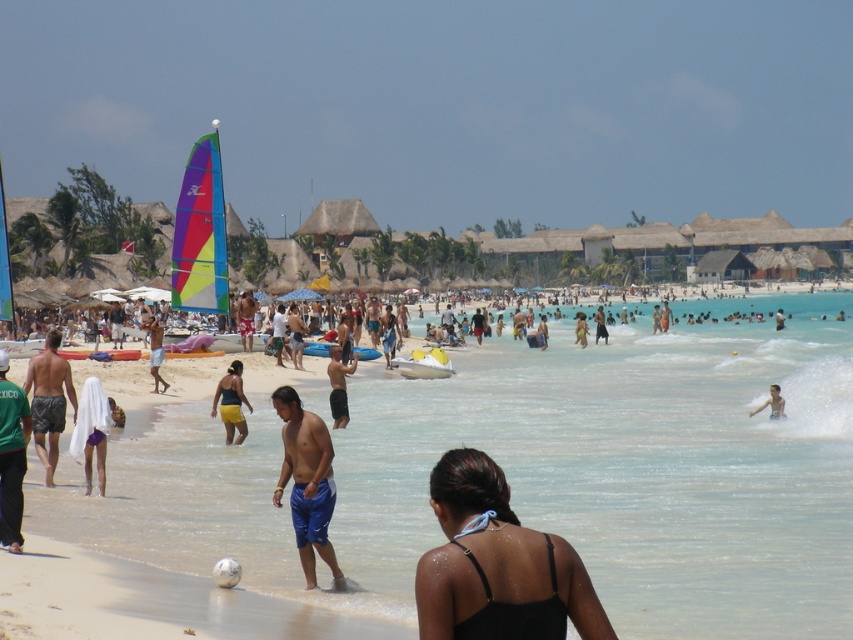
In the scene shown: Who is more distant from viewer, (247,337) or (390,305)?

Point (390,305)

Can you confirm if beige fabric shorts at center is positioned above shiny blue shorts at center?

Indeed, beige fabric shorts at center is positioned over shiny blue shorts at center.

The height and width of the screenshot is (640, 853). What do you see at coordinates (247, 320) in the screenshot?
I see `beige fabric shorts at center` at bounding box center [247, 320].

Where is `beige fabric shorts at center`? This screenshot has height=640, width=853. beige fabric shorts at center is located at coordinates (247, 320).

Locate an element on the screen. The width and height of the screenshot is (853, 640). matte yellow shorts at center is located at coordinates (231, 403).

Does matte yellow shorts at center lie in front of dark blue shorts at center?

Yes, it is in front of dark blue shorts at center.

This screenshot has width=853, height=640. What do you see at coordinates (231, 403) in the screenshot? I see `matte yellow shorts at center` at bounding box center [231, 403].

Locate an element on the screen. matte yellow shorts at center is located at coordinates (231, 403).

Does point (16, 525) lie in front of point (149, 369)?

Yes.

Can you confirm if green fabric shirt at lower left is thinner than tan skin man at center?

Yes.

The height and width of the screenshot is (640, 853). I want to click on green fabric shirt at lower left, so click(10, 456).

This screenshot has width=853, height=640. In order to click on green fabric shirt at lower left in this screenshot , I will do [10, 456].